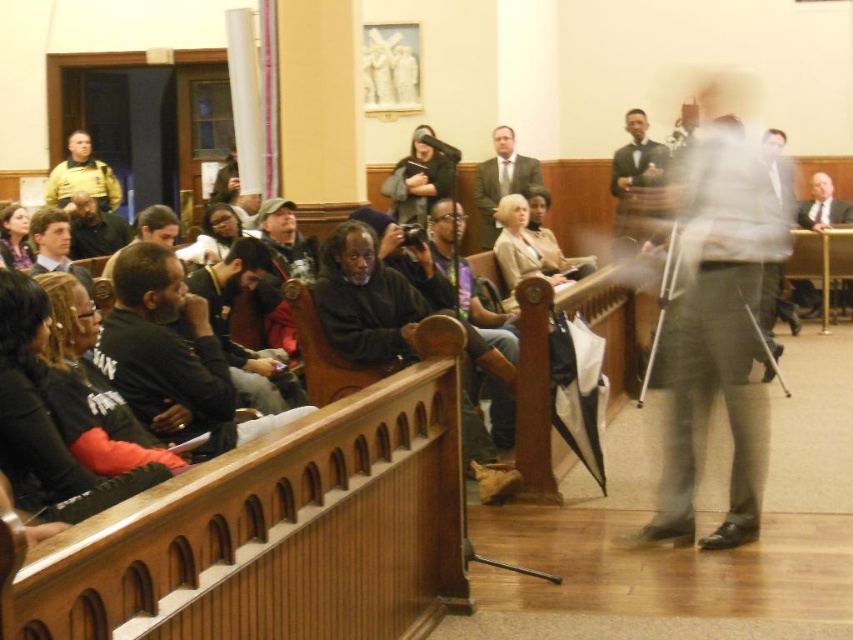
You are standing at the point labeled as point (492, 173) in a courtroom scene. If you want to take a photo of the entire room, would the camera positioned 13.30 meters away from you be able to capture the whole scene without moving?

The camera positioned 13.30 meters away from point (492, 173) might not capture the entire courtroom scene because the distance could be too far to include all areas of the room in one shot. Adjusting the camera position or using a wider lens might be necessary to ensure the entire scene is visible.

You are a security guard in the courtroom and need to locate the person wearing a matte gray suit at center. According to the coordinates provided, where should you look to find them?

The person wearing the matte gray suit at center is located at coordinates point (502, 180).